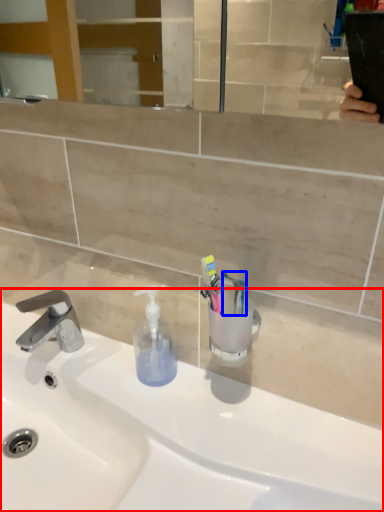
Question: Which object is further to the camera taking this photo, sink (highlighted by a red box) or toothbrush (highlighted by a blue box)?

Choices:
 (A) sink
 (B) toothbrush

Answer: (B)